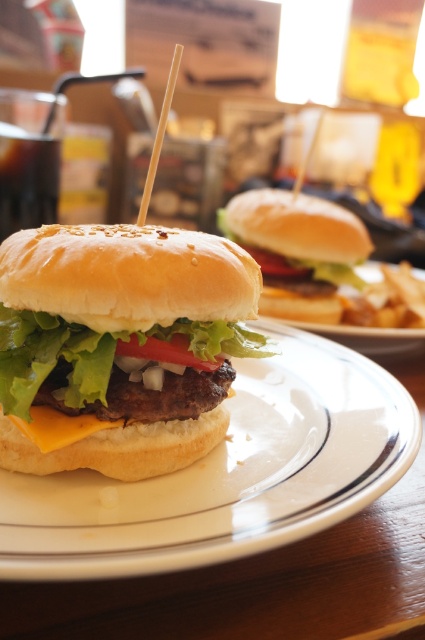
Question: Considering the real-world distances, which object is closest to the slightly toasted bun at center?

Choices:
 (A) semi-glossy bun at center
 (B) white ceramic plate at center
 (C) yellowish cheese at center

Answer: (B)

Question: Does semi-glossy bun at center appear on the left side of white ceramic plate at center?

Choices:
 (A) yes
 (B) no

Answer: (A)

Question: Considering the relative positions of semi-glossy bun at center and slightly toasted bun at center in the image provided, where is semi-glossy bun at center located with respect to slightly toasted bun at center?

Choices:
 (A) below
 (B) above

Answer: (A)

Question: Estimate the real-world distances between objects in this image. Which object is farther from the yellowish cheese at center?

Choices:
 (A) semi-glossy bun at center
 (B) slightly toasted bun at center
 (C) white ceramic plate at center

Answer: (B)

Question: Among these points, which one is farthest from the camera?

Choices:
 (A) (13, 420)
 (B) (172, 246)
 (C) (291, 300)
 (D) (22, 509)

Answer: (C)

Question: Is semi-glossy bun at center positioned at the back of white ceramic plate at center?

Choices:
 (A) no
 (B) yes

Answer: (B)